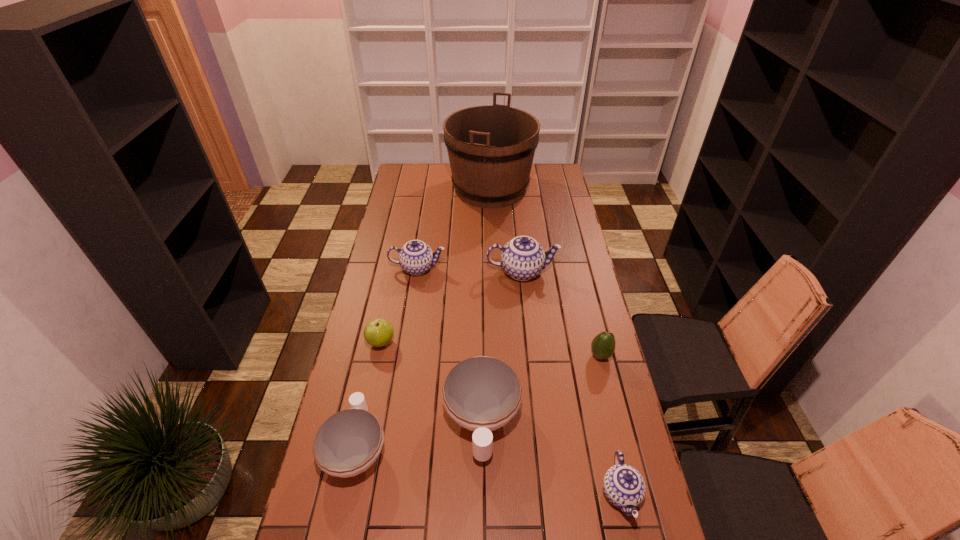
Identify the location of the left white chinaware. (348, 442).

I want to click on vacant space located on the front of the tallest object, so click(492, 257).

This screenshot has width=960, height=540. I want to click on free space located 0.100m at the spout of the tallest chinaware, so click(582, 272).

At what (x,y) coordinates should I click in order to perform the action: click on vacant space located at the spout of the second biggest blue chinaware. Please return your answer as a coordinate pair (x, y). This screenshot has width=960, height=540. Looking at the image, I should click on (465, 268).

Identify the location of free space located 0.050m on the side with the handle of the right white chinaware. This screenshot has height=540, width=960. (482, 487).

Locate an element on the screen. Image resolution: width=960 pixels, height=540 pixels. vacant region located on the front of the avocado is located at coordinates (612, 399).

The height and width of the screenshot is (540, 960). In order to click on free spot located 0.310m on the front of the green apple in this screenshot , I will do `click(361, 438)`.

At what (x,y) coordinates should I click in order to perform the action: click on vacant space located 0.260m on the side with the handle of the smaller white chinaware. Please return your answer as a coordinate pair (x, y). The image size is (960, 540). Looking at the image, I should click on (378, 345).

At what (x,y) coordinates should I click in order to perform the action: click on free space located 0.210m on the side with the handle of the smaller white chinaware. Please return your answer as a coordinate pair (x, y). Image resolution: width=960 pixels, height=540 pixels. Looking at the image, I should click on (375, 356).

Where is `free spot located on the side with the handle of the smaller white chinaware`? free spot located on the side with the handle of the smaller white chinaware is located at coordinates (370, 386).